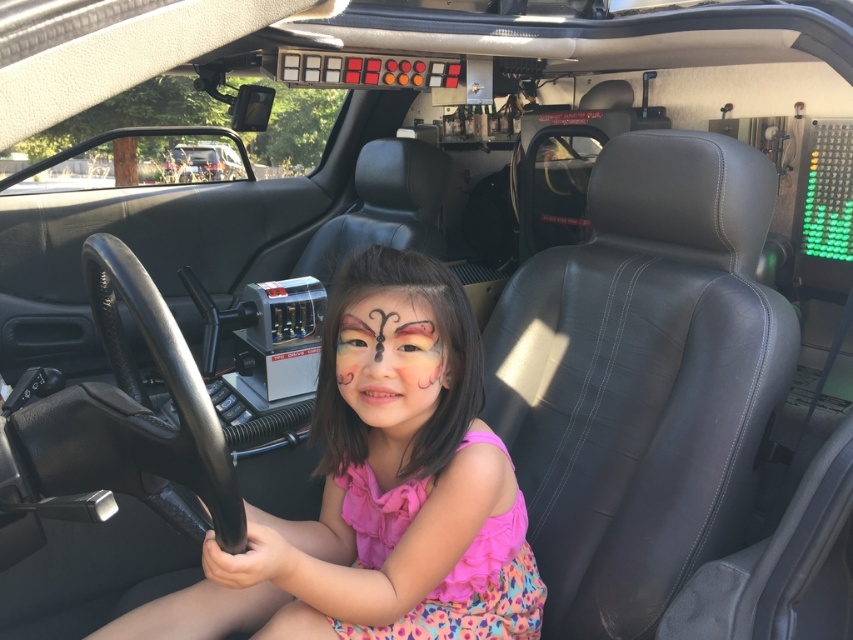
Does pink fabric dress at center appear on the right side of pastel pink face paint at center?

No, pink fabric dress at center is not to the right of pastel pink face paint at center.

Between point (436, 316) and point (422, 413), which one is positioned in front?

Point (436, 316) is in front.

The height and width of the screenshot is (640, 853). I want to click on pink fabric dress at center, so click(378, 497).

Can you confirm if matte pink face paint at center is positioned above metallic silver car at upper center?

No.

Can you confirm if matte pink face paint at center is positioned to the left of metallic silver car at upper center?

In fact, matte pink face paint at center is to the right of metallic silver car at upper center.

What do you see at coordinates (387, 320) in the screenshot?
I see `matte pink face paint at center` at bounding box center [387, 320].

The height and width of the screenshot is (640, 853). Identify the location of matte pink face paint at center. (387, 320).

Does pink fabric dress at center have a lesser height compared to metallic silver car at upper center?

No.

Is pink fabric dress at center above metallic silver car at upper center?

Incorrect, pink fabric dress at center is not positioned above metallic silver car at upper center.

This screenshot has height=640, width=853. What are the coordinates of `pink fabric dress at center` in the screenshot? It's located at (378, 497).

The width and height of the screenshot is (853, 640). In order to click on pink fabric dress at center in this screenshot , I will do `click(378, 497)`.